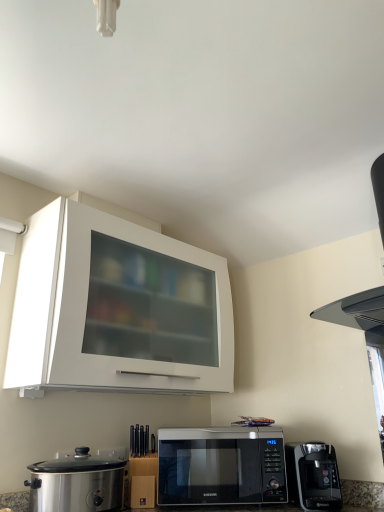
Question: In terms of height, does black glossy microwave at lower center look taller or shorter compared to stainless steel slow cooker at lower left?

Choices:
 (A) tall
 (B) short

Answer: (A)

Question: Is black glossy microwave at lower center to the left or to the right of stainless steel slow cooker at lower left in the image?

Choices:
 (A) right
 (B) left

Answer: (A)

Question: Which is nearer to the black matte vent at upper right?

Choices:
 (A) black plastic coffee maker at lower right
 (B) white glossy cabinet at upper center
 (C) stainless steel slow cooker at lower left
 (D) black glossy microwave at lower center

Answer: (A)

Question: Estimate the real-world distances between objects in this image. Which object is closer to the black plastic coffee maker at lower right?

Choices:
 (A) black matte vent at upper right
 (B) stainless steel slow cooker at lower left
 (C) black glossy microwave at lower center
 (D) white glossy cabinet at upper center

Answer: (C)